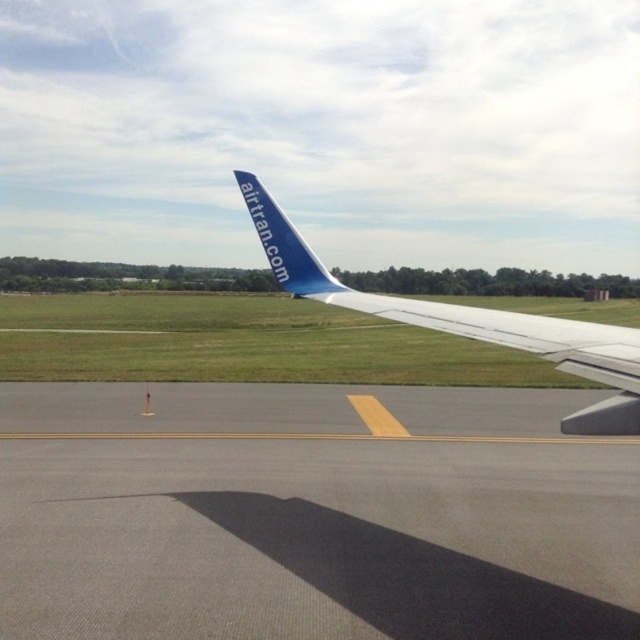
You are a pilot preparing for takeoff and need to ensure the gray asphalt runway at lower center is long enough for your aircraft. Given that the blue matte airplane tail at upper center is part of the same aircraft, can you determine if the runway length is sufficient based on their sizes in the image?

The gray asphalt runway at lower center is shorter than the blue matte airplane tail at upper center, which is part of the same aircraft. This suggests the runway may not be long enough for takeoff.

You are a passenger sitting in the aircraft and looking out the window. You see the blue painted wing at center and the white matte wing at center. Which wing is closer to the left side of the aircraft?

The blue painted wing at center is closer to the left side of the aircraft because it is positioned to the left of the white matte wing at center.

You are a flight attendant checking the aircraft exterior. From your current position inside the aircraft, where is the blue painted wing at center in relation to the yellow taxiway line on the tarmac?

The blue painted wing at center is located at point (467, 321), which is above the yellow taxiway line on the tarmac.